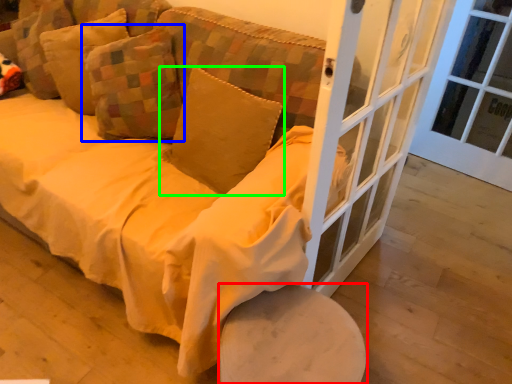
Question: Which object is positioned farthest from furniture (highlighted by a red box)? Select from pillow (highlighted by a blue box) and pillow (highlighted by a green box).

Choices:
 (A) pillow
 (B) pillow

Answer: (A)